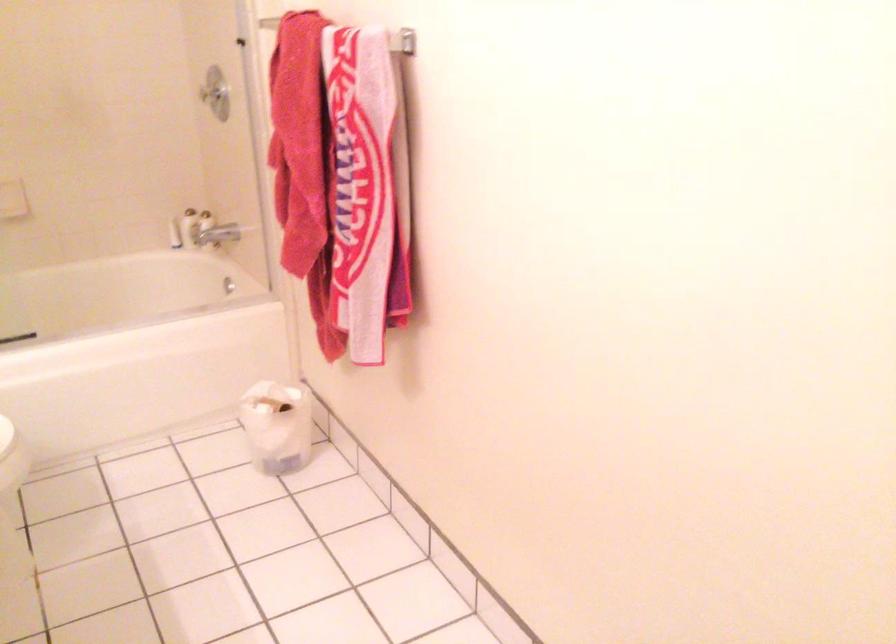
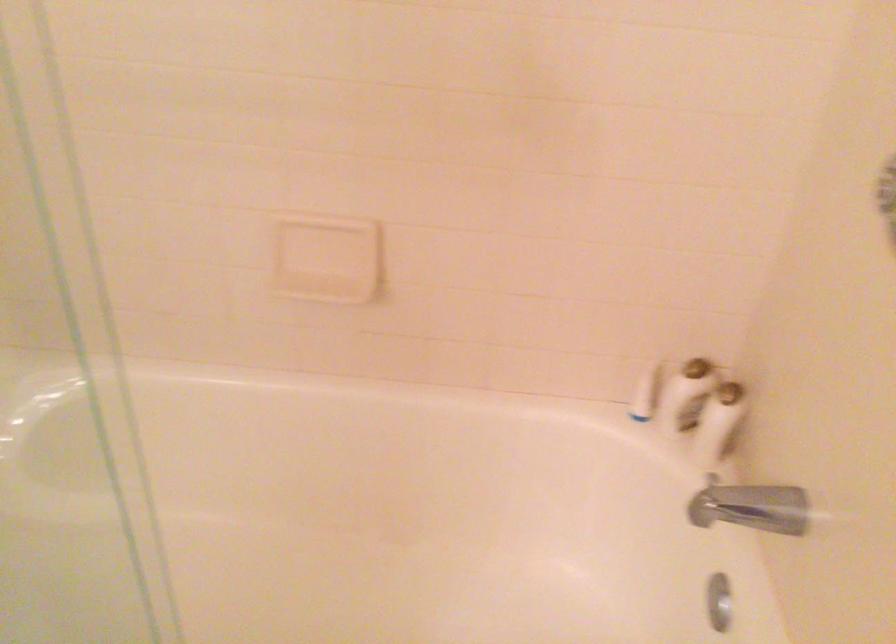
Where in the second image is the point corresponding to pixel 224 229 from the first image?

(757, 507)